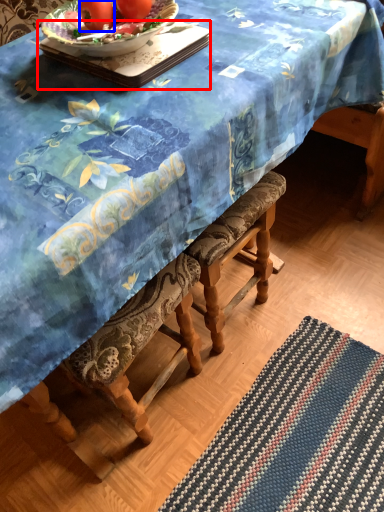
Question: Which object appears closest to the camera in this image, tray (highlighted by a red box) or tomato (highlighted by a blue box)?

Choices:
 (A) tray
 (B) tomato

Answer: (A)